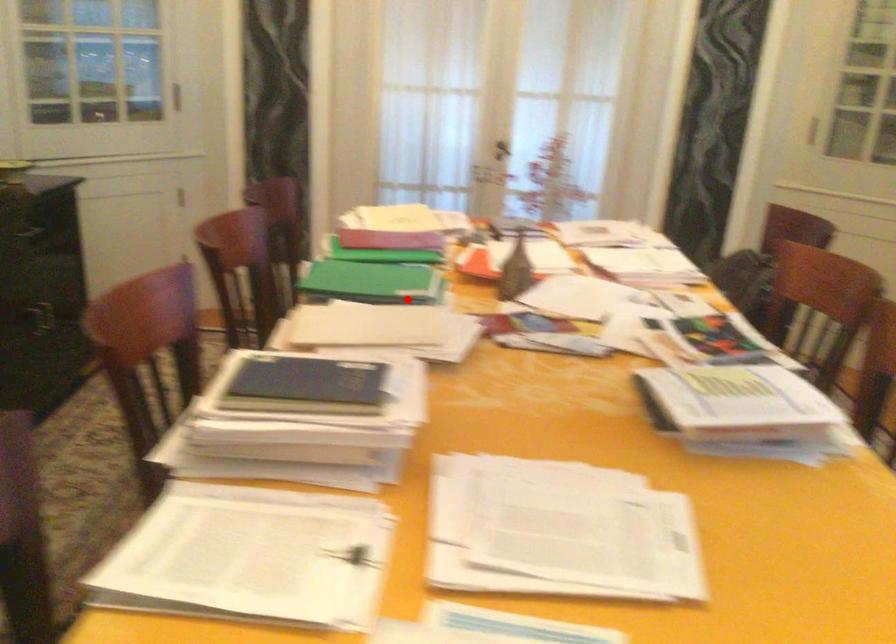
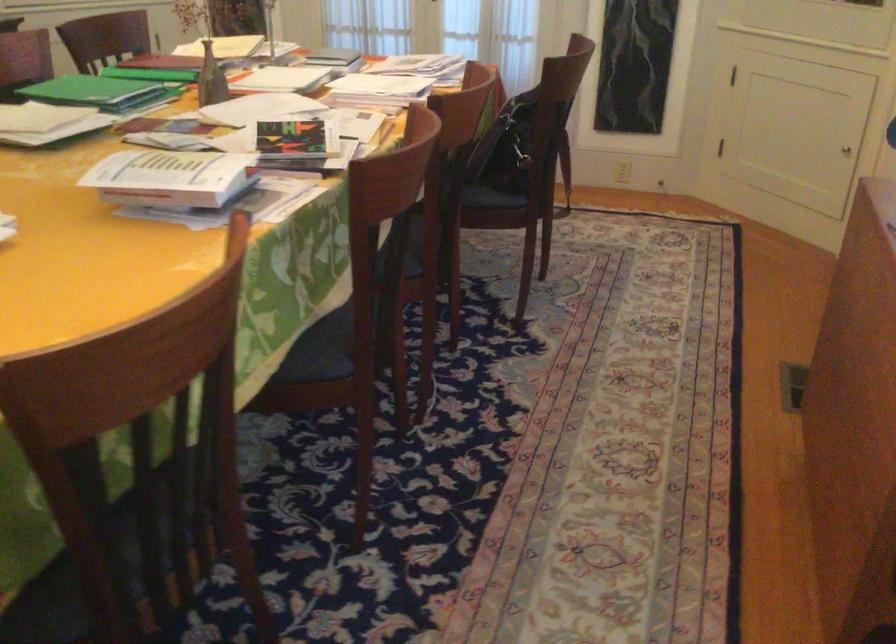
Find the pixel in the second image that matches the highlighted location in the first image.

(99, 91)